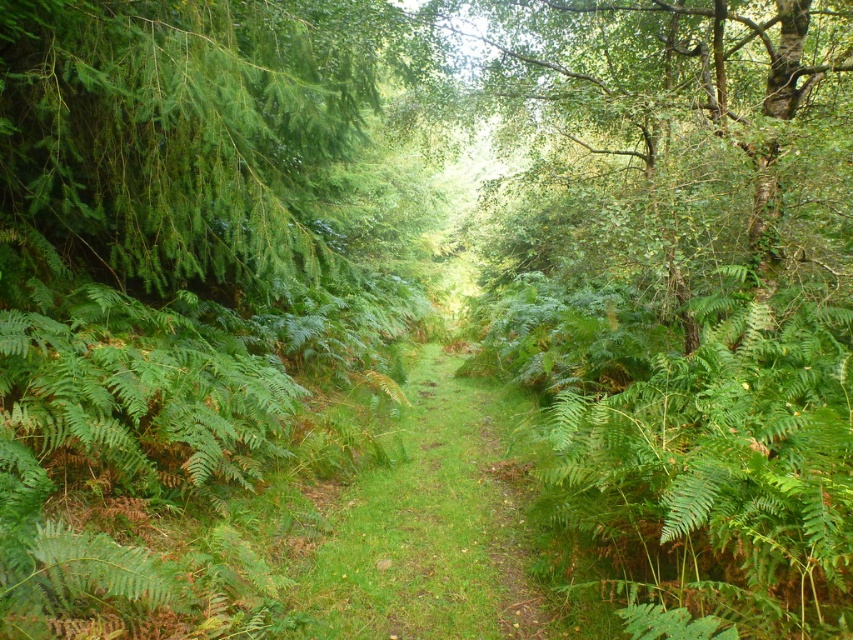
You are standing at the point marked by the coordinates (196, 132) on the forest path. Looking around, you notice a green leafy tree at left. Which direction should you face to see the green leafy tree at left from your current position?

You should face to the left direction to see the green leafy tree at left since the point indicates its location at left side.

You are a hiker walking along the green grassy forest path at center and want to know if you can spread out your picnic blanket under the green leafy tree at left. The blanket is 2 meters wide. Can you fit it under the tree without overlapping the edges?

The green leafy tree at left is narrower than the green grassy forest path at center, which is only 2 meters wide. Since the tree is narrower than the path, its width is less than 2 meters. Therefore, the picnic blanket that is 2 meters wide would not fit under the green leafy tree at left without overlapping the edges.